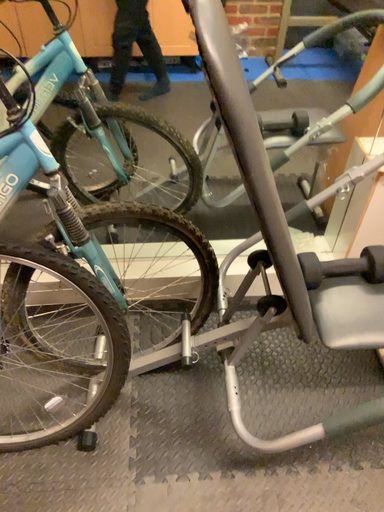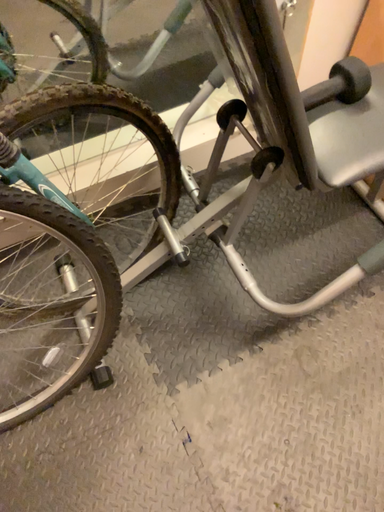
Question: Which way did the camera rotate in the video?

Choices:
 (A) rotated left
 (B) rotated right

Answer: (B)